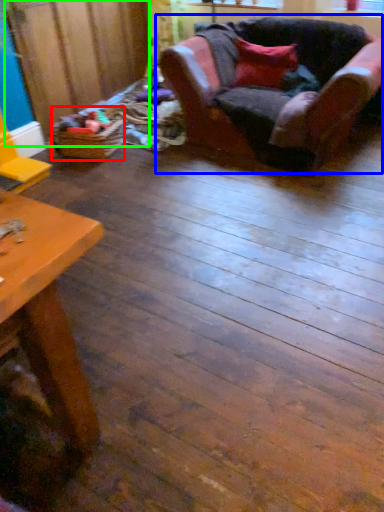
Question: Which object is the farthest from toy (highlighted by a red box)? Choose among these: chair (highlighted by a blue box) or plywood (highlighted by a green box).

Choices:
 (A) chair
 (B) plywood

Answer: (A)